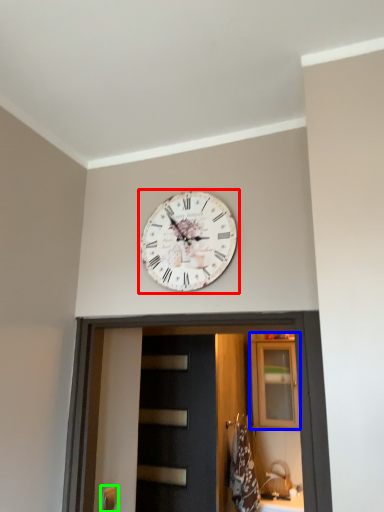
Question: Which object is positioned closest to wall clock (highlighted by a red box)? Select from cabinetry (highlighted by a blue box) and door handle (highlighted by a green box).

Choices:
 (A) cabinetry
 (B) door handle

Answer: (B)